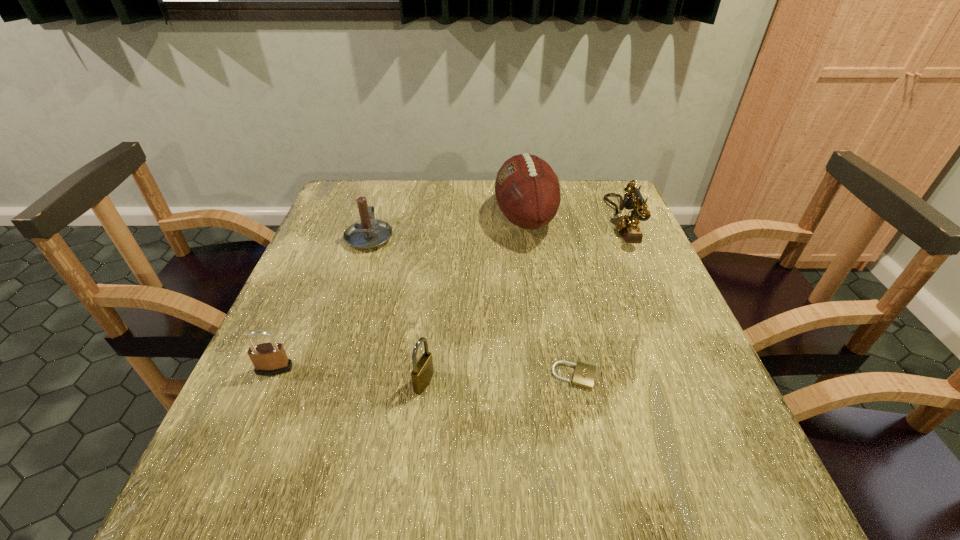
This screenshot has width=960, height=540. What are the coordinates of `the closest padlock relative to the shortest padlock` in the screenshot? It's located at (422, 373).

Identify which padlock is located as the nearest to the leftmost padlock. Please provide its 2D coordinates. Your answer should be formatted as a tuple, i.e. [(x, y)], where the tuple contains the x and y coordinates of a point satisfying the conditions above.

[(422, 373)]

At what (x,y) coordinates should I click in order to perform the action: click on vacant space that satisfies the following two spatial constraints: 1. on the front side of the leftmost padlock; 2. on the left side of the shortest padlock. Please return your answer as a coordinate pair (x, y). The height and width of the screenshot is (540, 960). Looking at the image, I should click on (272, 376).